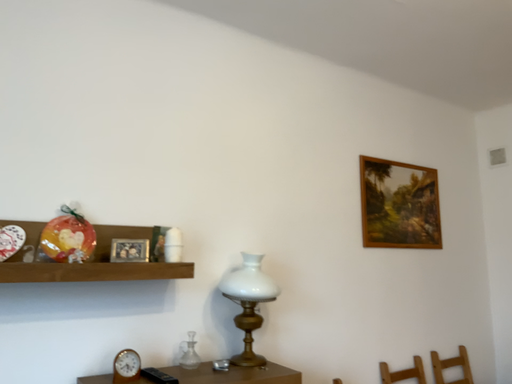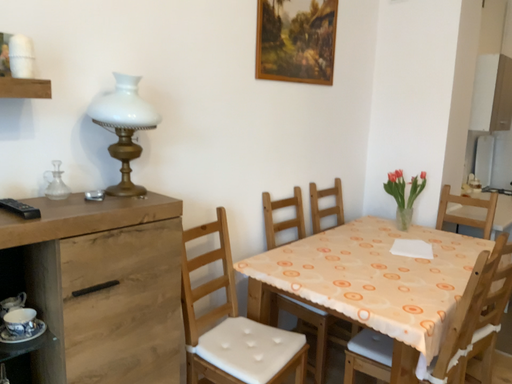
Question: How did the camera likely rotate when shooting the video?

Choices:
 (A) rotated upward
 (B) rotated downward

Answer: (B)